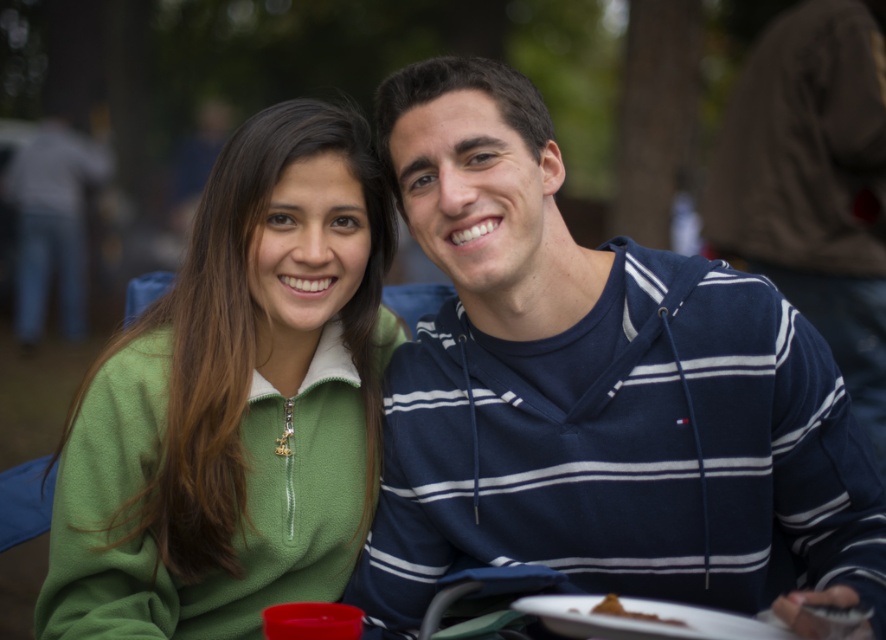
You are a photographer who wants to adjust the focus of your camera to capture the green fleece jacket at left in the image. Given that the point at coordinates (235,403) is where the jacket is located, can you confirm if this point is within the current focus area of the camera?

Yes, the point at (235,403) corresponds to the green fleece jacket at left, so adjusting the focus to this point will ensure the jacket is in focus.

You are a photographer setting up for a group photo. You need to ensure that the two subjects wearing the navy blue hoodie at center and the green fleece jacket at left are at least 14 inches apart for proper framing. Based on the current setup, is their current distance sufficient?

The navy blue hoodie at center is only 13.10 inches from the green fleece jacket at left, which is less than the required 14 inches. Therefore, they need to move slightly farther apart to meet the distance requirement.